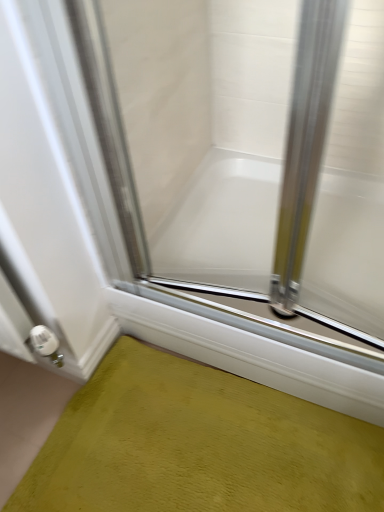
Question: Does clear glass door at center appear on the left side of white glossy bathtub at center?

Choices:
 (A) no
 (B) yes

Answer: (B)

Question: From the image's perspective, is clear glass door at center under white glossy bathtub at center?

Choices:
 (A) yes
 (B) no

Answer: (B)

Question: Can you confirm if clear glass door at center is taller than white glossy bathtub at center?

Choices:
 (A) no
 (B) yes

Answer: (B)

Question: Is clear glass door at center looking in the opposite direction of white glossy bathtub at center?

Choices:
 (A) yes
 (B) no

Answer: (A)

Question: Is clear glass door at center positioned behind white glossy bathtub at center?

Choices:
 (A) yes
 (B) no

Answer: (B)

Question: From a real-world perspective, is clear glass door at center beneath white glossy bathtub at center?

Choices:
 (A) no
 (B) yes

Answer: (A)

Question: From the image's perspective, is green textured bath mat at lower left below clear glass door at center?

Choices:
 (A) yes
 (B) no

Answer: (A)

Question: Can clear glass door at center be found inside green textured bath mat at lower left?

Choices:
 (A) no
 (B) yes

Answer: (A)

Question: From a real-world perspective, is green textured bath mat at lower left located higher than clear glass door at center?

Choices:
 (A) yes
 (B) no

Answer: (B)

Question: Does green textured bath mat at lower left appear on the left side of clear glass door at center?

Choices:
 (A) yes
 (B) no

Answer: (B)

Question: Is green textured bath mat at lower left positioned in front of clear glass door at center?

Choices:
 (A) yes
 (B) no

Answer: (B)

Question: Considering the relative sizes of green textured bath mat at lower left and clear glass door at center in the image provided, is green textured bath mat at lower left thinner than clear glass door at center?

Choices:
 (A) no
 (B) yes

Answer: (A)

Question: Could you tell me if clear glass door at center is turned towards green textured bath mat at lower left?

Choices:
 (A) no
 (B) yes

Answer: (B)